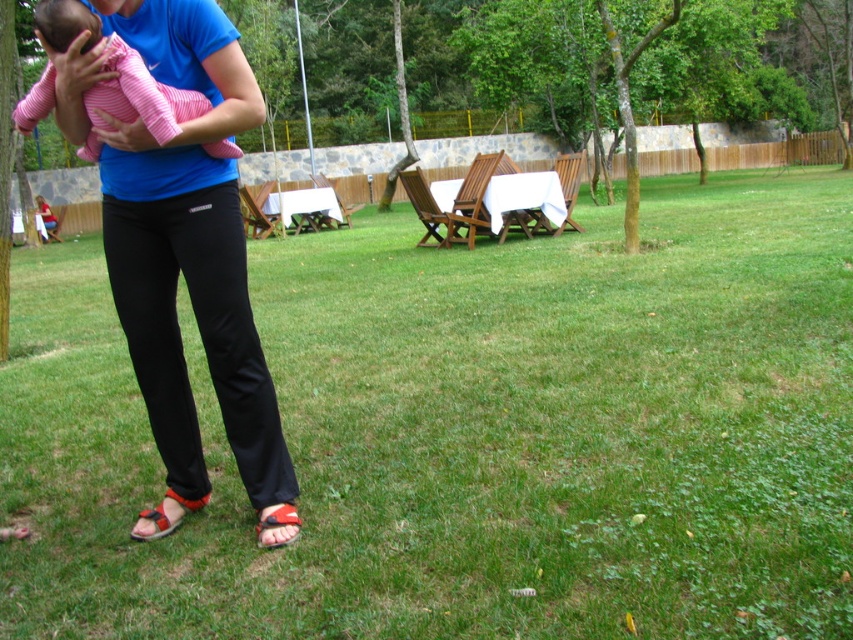
You are a photographer setting up a shot in the park. You want to ensure the pink striped fabric baby at center is fully visible without being hidden by the green grass at center. Based on their sizes, is this possible?

The green grass at center might be wider than pink striped fabric baby at center, so there is a possibility that the grass could obscure parts of the baby if not positioned carefully. Ensure the baby is centered and elevated slightly to avoid being hidden by the wider grass area.

You are a photographer setting up for a family portrait. You need to position the pink striped fabric baby at center so that it doesn not block the view of the red leather sandal at lower center. Based on the scene, can you place the baby in a way that allows both objects to be visible without obstruction?

The pink striped fabric baby at center is above the red leather sandal at lower center. Since the baby is positioned higher, you can angle the camera slightly downward to ensure both the baby and the sandal are visible without one blocking the other.